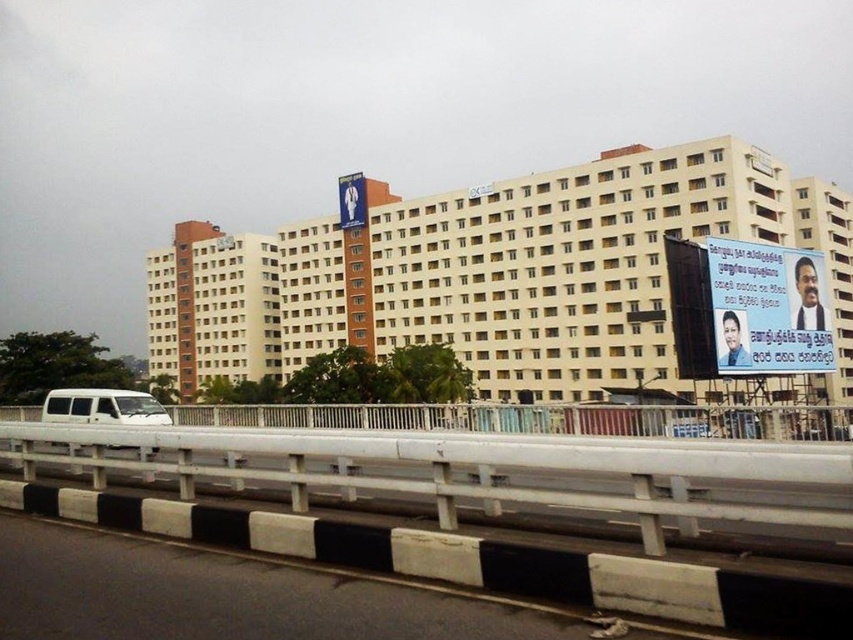
You are a delivery driver who needs to park your white matte van at lower left in a spot that requires precise positioning. The parking spot has a maximum length of 1.8 meters. Can you fit your van in this spot?

The white matte van at lower left is positioned at point coordinates that do not indicate its length, so we cannot determine if it fits in the 1.8 meter spot. More information is needed.

You are a delivery driver approaching the beige concrete building at center and the blue glossy poster at upper right. Which object will you see first as you drive towards the building?

The beige concrete building at center will be seen first because it is wider than the blue glossy poster at upper right, making it more prominent in the driver approach.